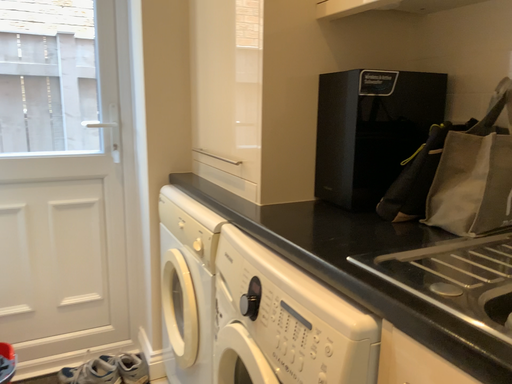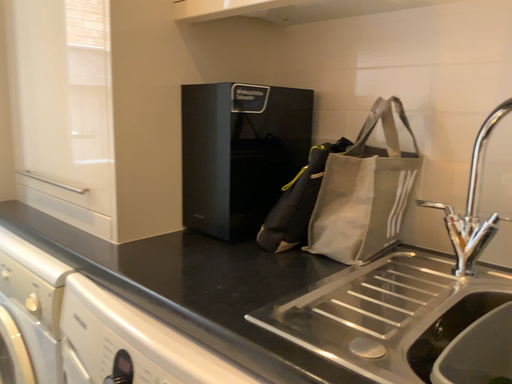
Question: Which way did the camera rotate in the video?

Choices:
 (A) rotated right
 (B) rotated left

Answer: (A)